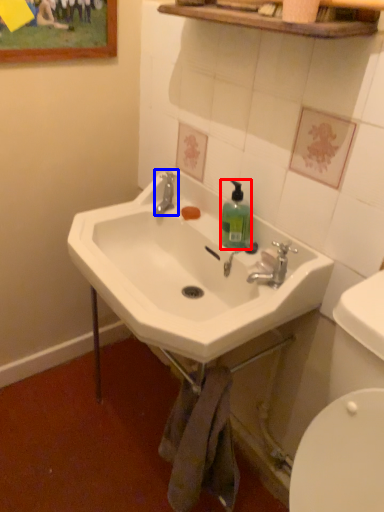
Question: Which point is further to the camera, bottle (highlighted by a red box) or plumbing fixture (highlighted by a blue box)?

Choices:
 (A) bottle
 (B) plumbing fixture

Answer: (B)